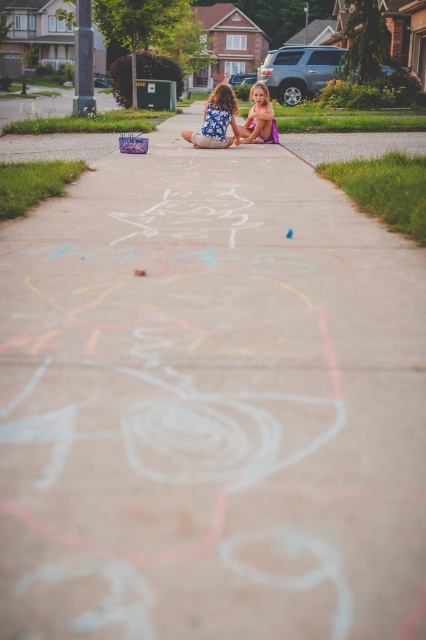
Between blue floral dress at center and matte purple dress at center, which one has more height?

With more height is matte purple dress at center.

Measure the distance between point (186,136) and camera.

Point (186,136) and camera are 9.46 meters apart from each other.

Is point (215, 106) less distant than point (264, 116)?

Yes, point (215, 106) is in front of point (264, 116).

This screenshot has height=640, width=426. Find the location of `blue floral dress at center`. blue floral dress at center is located at coordinates (216, 120).